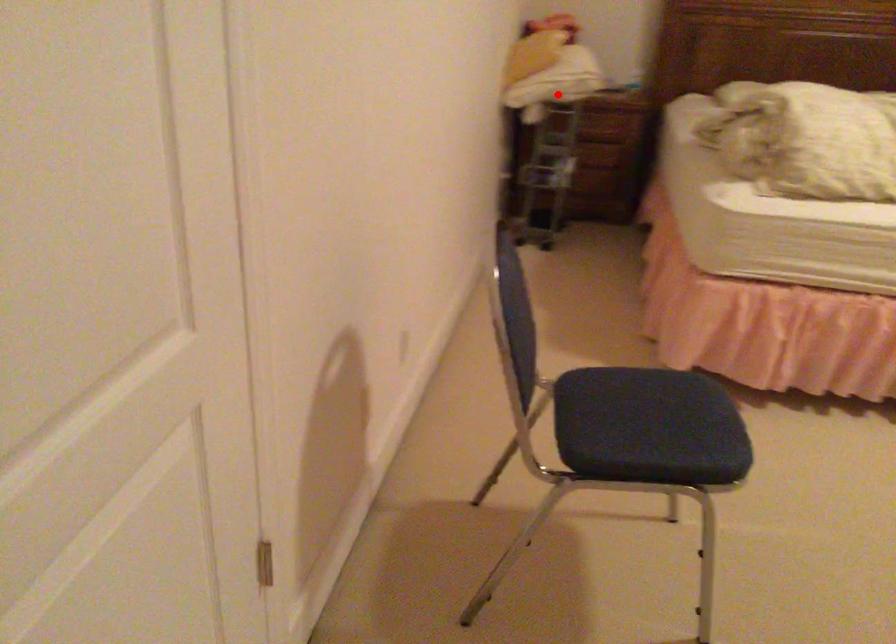
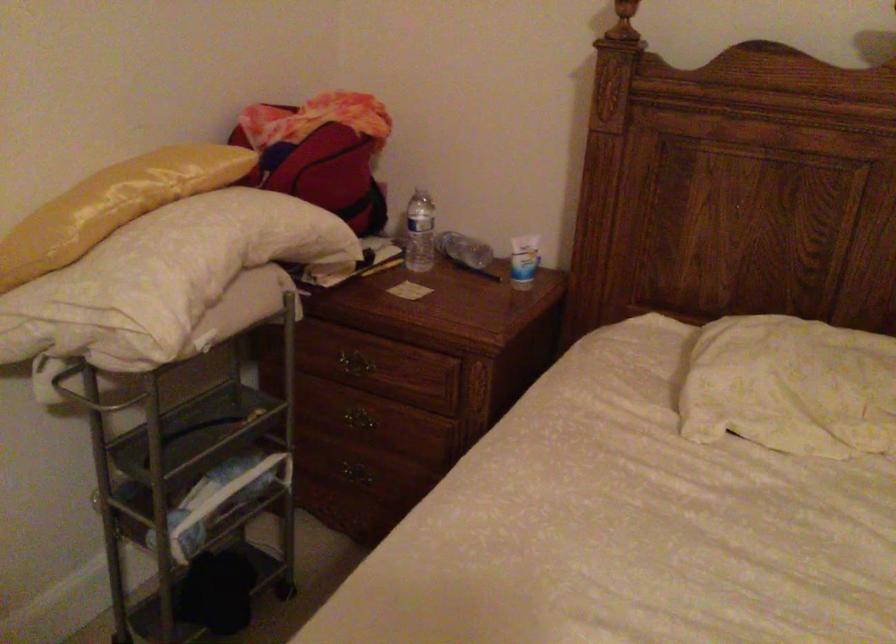
Where in the second image is the point corresponding to the highlighted location from the first image?

(91, 393)